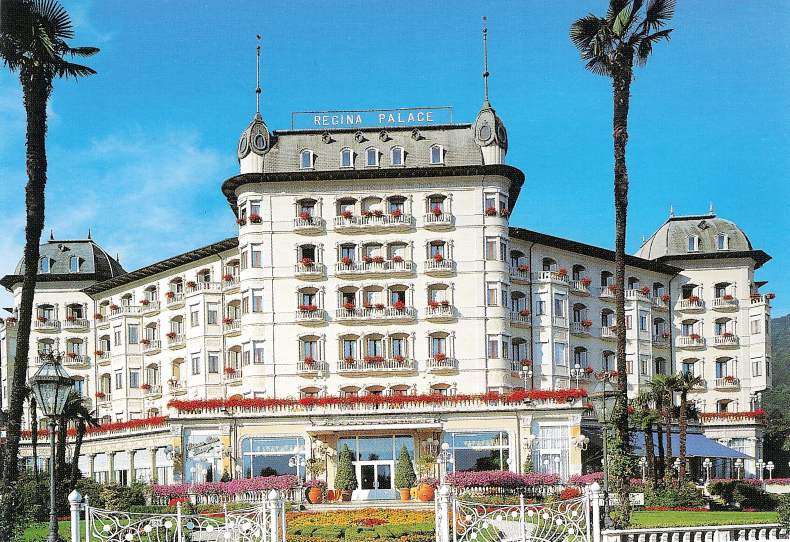
At what (x,y) coordinates should I click in order to perform the action: click on right door. Please return your answer as a coordinate pair (x, y). This screenshot has height=542, width=790. Looking at the image, I should click on (382, 468).